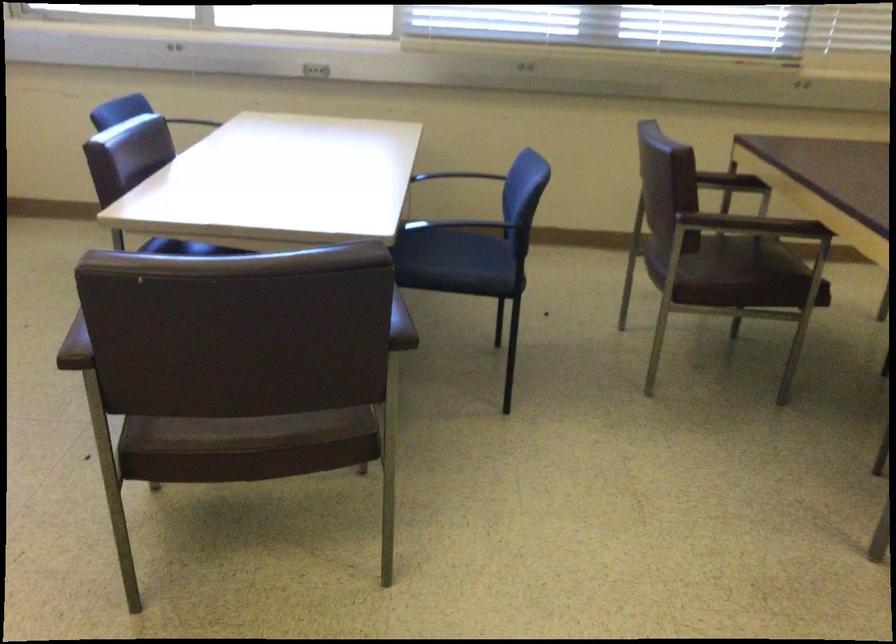
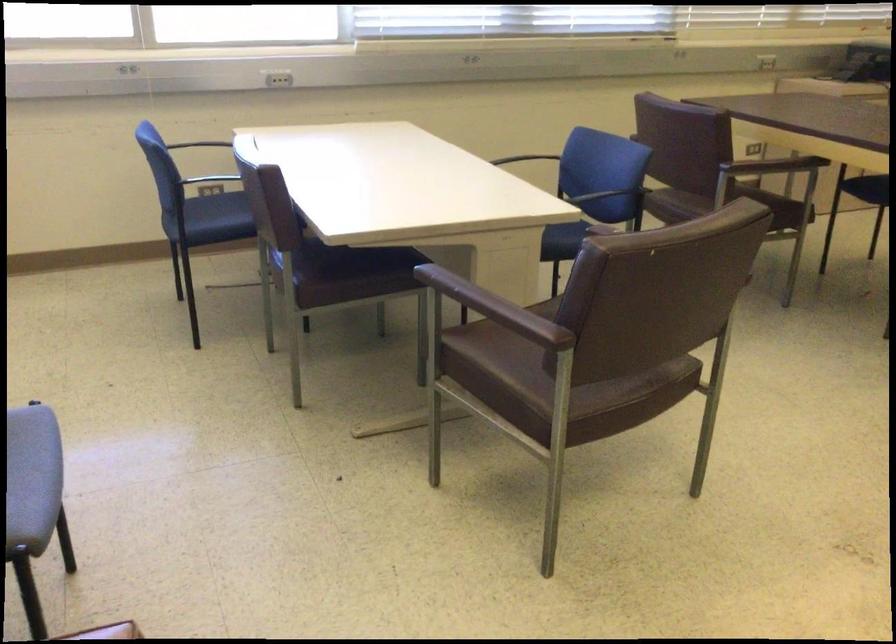
Where in the second image is the point corresponding to the point at 194,447 from the first image?

(588, 404)